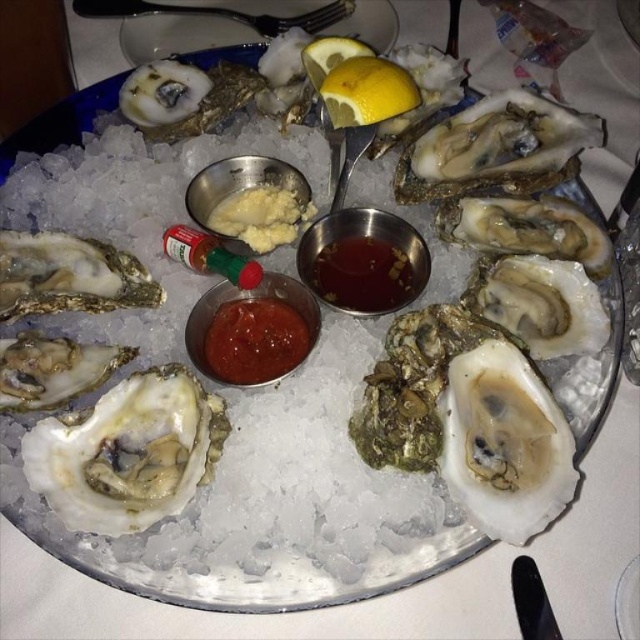
Question: Is white shell oyster at center further to camera compared to white glossy oyster at lower right?

Choices:
 (A) no
 (B) yes

Answer: (B)

Question: Which object is the farthest from the yellow matte lemon at upper center?

Choices:
 (A) red glossy sauce at center
 (B) yellow lemon at upper center
 (C) white glossy oyster at lower right

Answer: (C)

Question: Among these points, which one is farthest from the camera?

Choices:
 (A) (486, 365)
 (B) (29, 456)
 (C) (90, 253)
 (D) (355, 56)

Answer: (D)

Question: Which of the following is the farthest from the observer?

Choices:
 (A) (544, 432)
 (B) (352, 68)
 (C) (275, 298)
 (D) (92, 292)

Answer: (B)

Question: Is white shell oyster at center to the right of white shell oyster at left from the viewer's perspective?

Choices:
 (A) no
 (B) yes

Answer: (B)

Question: Considering the relative positions of translucent amber liquid at center and red glossy sauce at center in the image provided, where is translucent amber liquid at center located with respect to red glossy sauce at center?

Choices:
 (A) below
 (B) above

Answer: (B)